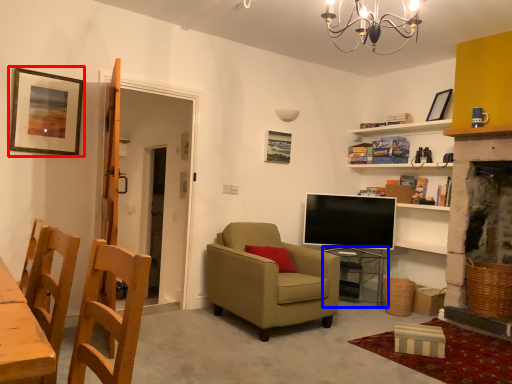
Question: Which object appears farthest to the camera in this image, picture frame (highlighted by a red box) or table (highlighted by a blue box)?

Choices:
 (A) picture frame
 (B) table

Answer: (B)